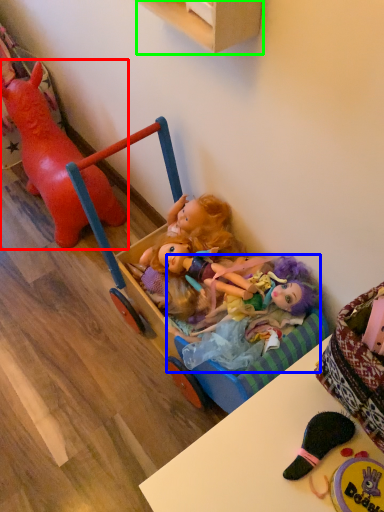
Question: Considering the real-world distances, which object is closest to toy (highlighted by a red box)? doll (highlighted by a blue box) or cabinetry (highlighted by a green box).

Choices:
 (A) doll
 (B) cabinetry

Answer: (B)